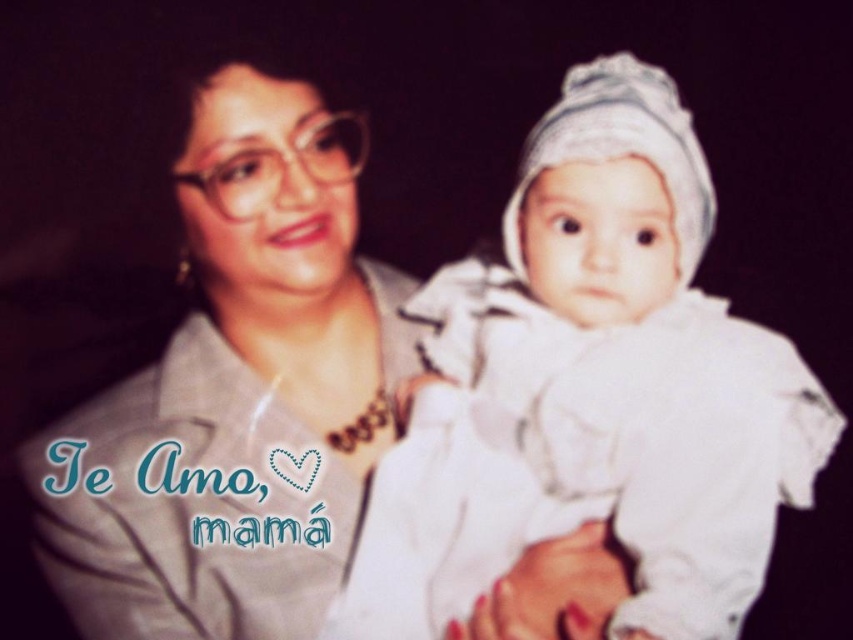
Is white soft cloth at center wider than matte gray shirt at center?

Yes, white soft cloth at center is wider than matte gray shirt at center.

Does white soft cloth at center have a larger size compared to matte gray shirt at center?

Yes, white soft cloth at center is bigger than matte gray shirt at center.

Is point (488, 301) farther from camera compared to point (349, 433)?

That is False.

Where is `white soft cloth at center`? The image size is (853, 640). white soft cloth at center is located at coordinates (596, 390).